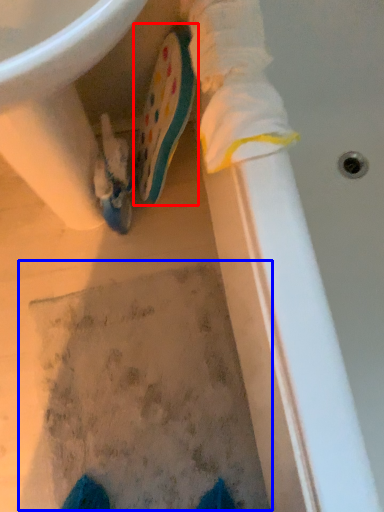
Question: Which object is closer to the camera taking this photo, footwear (highlighted by a red box) or footprint (highlighted by a blue box)?

Choices:
 (A) footwear
 (B) footprint

Answer: (A)